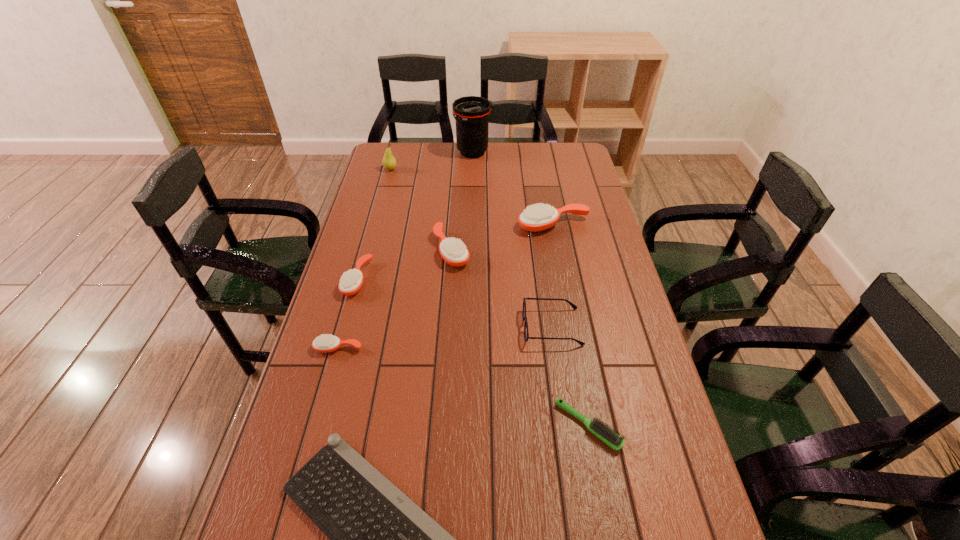
The width and height of the screenshot is (960, 540). I want to click on vacant point that satisfies the following two spatial constraints: 1. on the back side of the pear; 2. on the left side of the fourth farthest hairbrush, so click(388, 170).